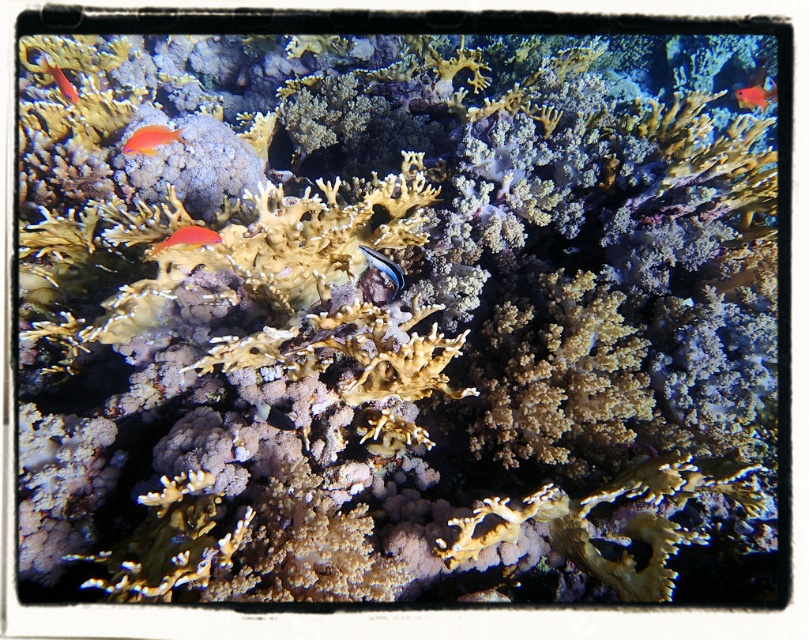
You are a marine biologist observing this underwater scene. You notice the bright orange coral at upper left and the shiny orange fish at left. Which of these two objects is taller?

The bright orange coral at upper left is taller than the shiny orange fish at left according to the description.

You are a marine biologist observing this underwater scene. You notice the blue glossy fish at center and the shiny orange fish at upper left. Based on their sizes, which fish would you estimate has a greater mass?

The shiny orange fish at upper left has a greater mass since it is larger in size compared to the blue glossy fish at center.

You are a marine biologist studying coral locations in the underwater scene. You need to place a research buoy exactly at the coordinates point 0.217, 0.187. Will the bright orange coral at upper left be directly under the buoy when it is dropped?

The bright orange coral at upper left is located at point (150, 138), so yes, the bright orange coral at upper left will be directly under the buoy when it is dropped there.